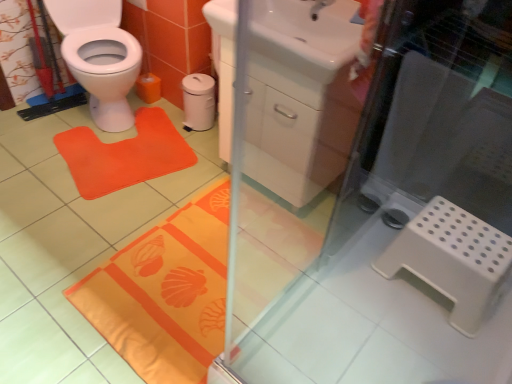
Question: From the image's perspective, is white matte trash can at center above or below white plastic step stool at lower right?

Choices:
 (A) above
 (B) below

Answer: (A)

Question: Relative to white plastic step stool at lower right, is white matte trash can at center in front or behind?

Choices:
 (A) behind
 (B) front

Answer: (A)

Question: Considering the real-world distances, which object is closest to the white glossy sink at upper center?

Choices:
 (A) orange fabric mat at left
 (B) white plastic step stool at lower right
 (C) orange fabric bath mat at lower center
 (D) transparent glass screen door at upper center
 (E) white matte trash can at center

Answer: (D)

Question: Estimate the real-world distances between objects in this image. Which object is farther from the white plastic step stool at lower right?

Choices:
 (A) matte white tap at upper center
 (B) orange fabric bath mat at lower center
 (C) transparent glass screen door at upper center
 (D) orange fabric mat at left
 (E) white glossy sink at upper center

Answer: (D)